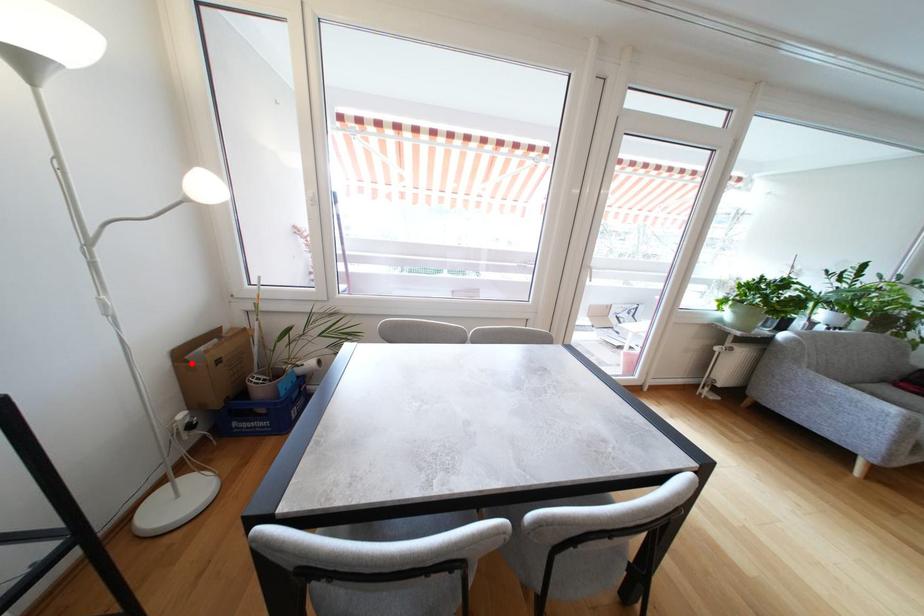
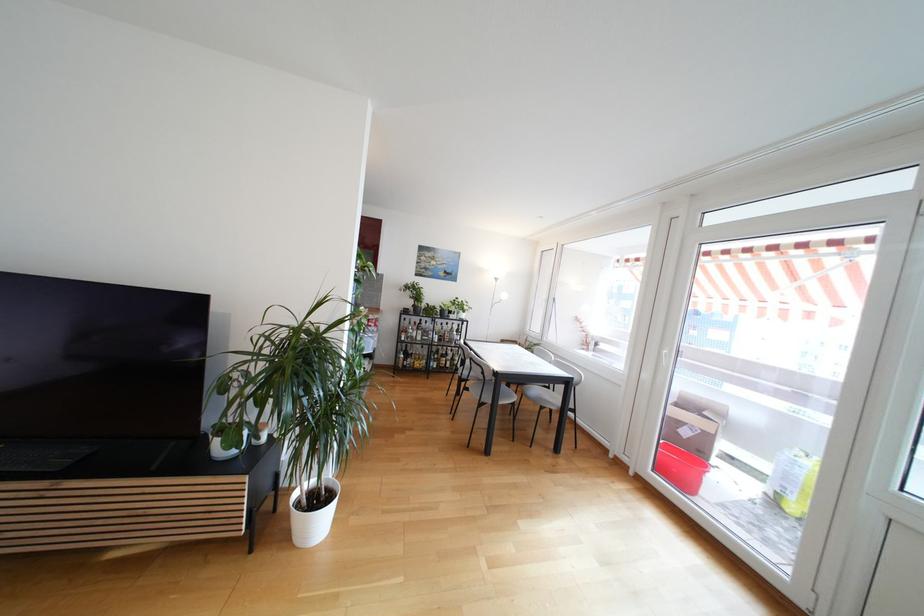
Question: I am providing you with two images of the same scene from different viewpoints. A red point is marked on the first image. At the location where the point appears in image 1, is it still visible in image 2?

Choices:
 (A) Yes
 (B) No

Answer: (B)